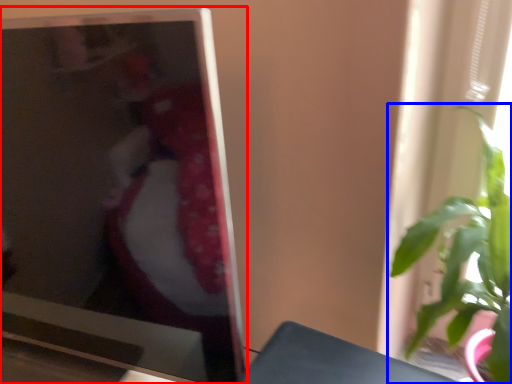
Question: Which object appears closest to the camera in this image, television (highlighted by a red box) or houseplant (highlighted by a blue box)?

Choices:
 (A) television
 (B) houseplant

Answer: (A)